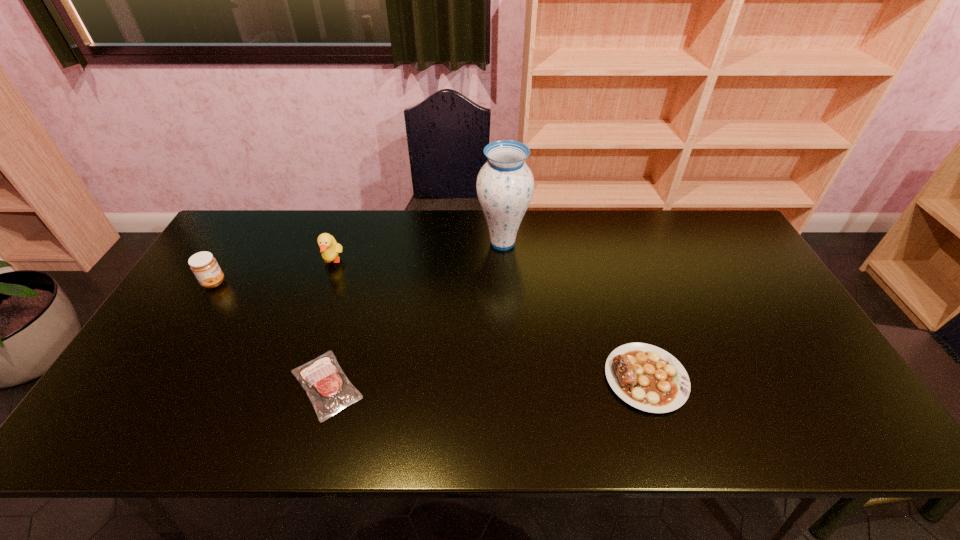
At what (x,y) coordinates should I click in order to perform the action: click on vase. Please return your answer as a coordinate pair (x, y). Looking at the image, I should click on (505, 184).

The image size is (960, 540). What are the coordinates of `the fourth object from left to right` in the screenshot? It's located at (505, 184).

Image resolution: width=960 pixels, height=540 pixels. Find the location of `duckling`. duckling is located at coordinates (329, 248).

In order to click on the leftmost object in this screenshot , I will do `click(204, 266)`.

Identify the location of the third farthest object. (204, 266).

You are a GUI agent. You are given a task and a screenshot of the screen. Output one action in this format:
    pyautogui.click(x=<x>, y=<y>)
    Task: Click on the right steak
    This screenshot has height=540, width=960.
    Given the screenshot: What is the action you would take?
    (646, 377)

Locate an element on the screen. This screenshot has height=540, width=960. the rightmost object is located at coordinates (646, 377).

The width and height of the screenshot is (960, 540). I want to click on the left steak, so click(328, 388).

Where is `the shortest object`? the shortest object is located at coordinates (328, 388).

Where is `vacant space located 0.230m on the right of the vase`? vacant space located 0.230m on the right of the vase is located at coordinates (598, 243).